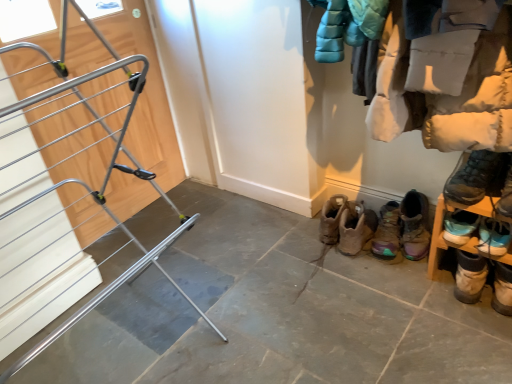
I want to click on vacant area on top of gray stone floor at center (from a real-world perspective), so click(x=264, y=302).